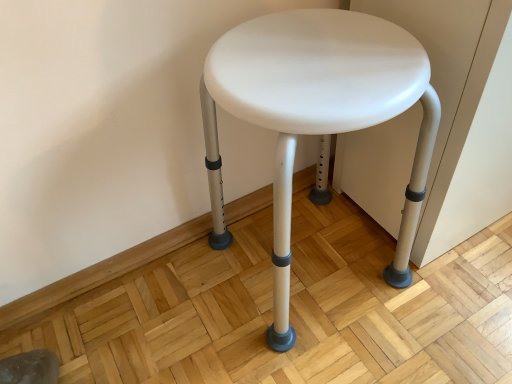
The height and width of the screenshot is (384, 512). What do you see at coordinates (30, 368) in the screenshot?
I see `white plastic stool at center` at bounding box center [30, 368].

In order to face white plastic stool at center, should I rotate leftwards or rightwards?

A 31.301 degree turn to the left will do.

Identify the location of white plastic stool at center. (30, 368).

Measure the distance between white plastic stool at center and camera.

A distance of 27.14 inches exists between white plastic stool at center and camera.

Describe the element at coordinates (323, 107) in the screenshot. I see `white plastic stool at center` at that location.

At what (x,y) coordinates should I click in order to perform the action: click on white plastic stool at center. Please return your answer as a coordinate pair (x, y). Looking at the image, I should click on (323, 107).

The height and width of the screenshot is (384, 512). In order to click on white plastic stool at center in this screenshot , I will do pyautogui.click(x=30, y=368).

Would you say white plastic stool at center is to the left or to the right of white plastic stool at center in the picture?

white plastic stool at center is to the right of white plastic stool at center.

In the image, is white plastic stool at center positioned in front of or behind white plastic stool at center?

Visually, white plastic stool at center is located in front of white plastic stool at center.

Which point is more forward, (400, 244) or (44, 365)?

Positioned in front is point (44, 365).

From the image's perspective, is white plastic stool at center positioned above or below white plastic stool at center?

From the image's perspective, white plastic stool at center appears above white plastic stool at center.

From a real-world perspective, is white plastic stool at center beneath white plastic stool at center?

Actually, white plastic stool at center is physically above white plastic stool at center in the real world.

Based on the photo, considering the sizes of objects white plastic stool at center and white plastic stool at center in the image provided, who is thinner, white plastic stool at center or white plastic stool at center?

white plastic stool at center.

Considering the relative sizes of white plastic stool at center and white plastic stool at center in the image provided, is white plastic stool at center shorter than white plastic stool at center?

No, white plastic stool at center is not shorter than white plastic stool at center.

Considering the relative sizes of white plastic stool at center and white plastic stool at center in the image provided, is white plastic stool at center bigger than white plastic stool at center?

Result: Indeed, white plastic stool at center has a larger size compared to white plastic stool at center.

Is white plastic stool at center not inside white plastic stool at center?

Yes, white plastic stool at center is located beyond the bounds of white plastic stool at center.

Is white plastic stool at center placed right next to white plastic stool at center?

There is a gap between white plastic stool at center and white plastic stool at center.

Is white plastic stool at center facing towards white plastic stool at center?

No, white plastic stool at center is not turned towards white plastic stool at center.

Can you tell me how much white plastic stool at center and white plastic stool at center differ in facing direction?

There is a 1.23-degree angle between the facing directions of white plastic stool at center and white plastic stool at center.

Locate an element on the screen. stool above the white plastic stool at center (from the image's perspective) is located at coordinates (323, 107).

Would you say white plastic stool at center is to the left or to the right of white plastic stool at center in the picture?

white plastic stool at center is positioned on white plastic stool at center's left side.

Is white plastic stool at center closer to the viewer compared to white plastic stool at center?

No, the depth of white plastic stool at center is greater than that of white plastic stool at center.

Between point (21, 368) and point (414, 176), which one is positioned in front?

The point (414, 176) is more forward.

From the image's perspective, which object appears higher, white plastic stool at center or white plastic stool at center?

white plastic stool at center appears higher in the image.

From a real-world perspective, is white plastic stool at center positioned above or below white plastic stool at center?

white plastic stool at center is below white plastic stool at center.

Considering the sizes of white plastic stool at center and white plastic stool at center in the image, is white plastic stool at center wider or thinner than white plastic stool at center?

white plastic stool at center is thinner than white plastic stool at center.

Can you confirm if white plastic stool at center is shorter than white plastic stool at center?

Correct, white plastic stool at center is not as tall as white plastic stool at center.

Considering the sizes of white plastic stool at center and white plastic stool at center in the image, is white plastic stool at center bigger or smaller than white plastic stool at center?

Clearly, white plastic stool at center is smaller in size than white plastic stool at center.

Is white plastic stool at center not within white plastic stool at center?

Absolutely, white plastic stool at center is external to white plastic stool at center.

Is white plastic stool at center not near white plastic stool at center?

No, white plastic stool at center is in close proximity to white plastic stool at center.

Is white plastic stool at center positioned with its back to white plastic stool at center?

No.

How different are the orientations of white plastic stool at center and white plastic stool at center in degrees?

The angular difference between white plastic stool at center and white plastic stool at center is 1.23 degrees.

There is a white plastic stool at center. At what (x,y) coordinates should I click in order to perform the action: click on stool above it (from a real-world perspective). Please return your answer as a coordinate pair (x, y). This screenshot has width=512, height=384. Looking at the image, I should click on (323, 107).

This screenshot has height=384, width=512. Identify the location of swivel chair located behind the white plastic stool at center. (30, 368).

In order to click on stool in front of the white plastic stool at center in this screenshot , I will do `click(323, 107)`.